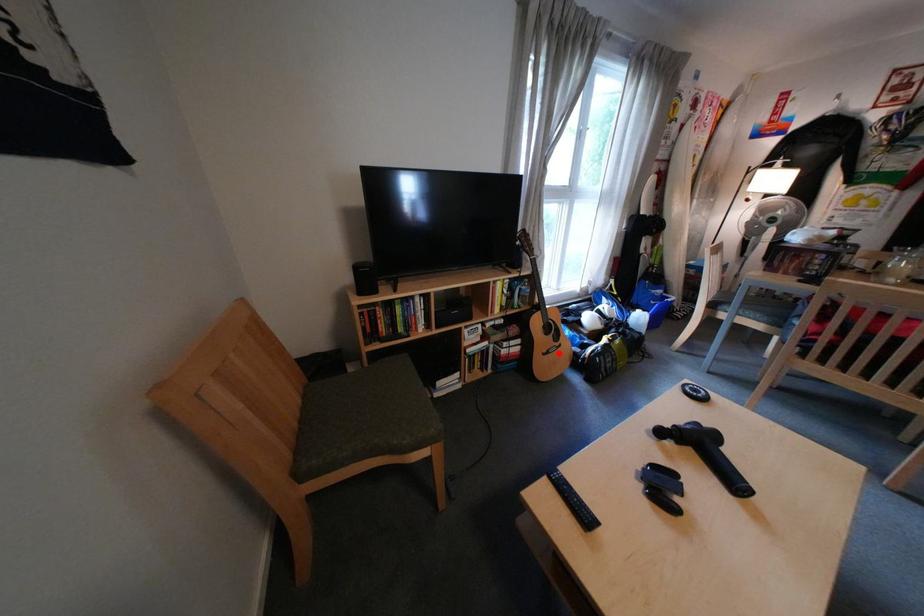
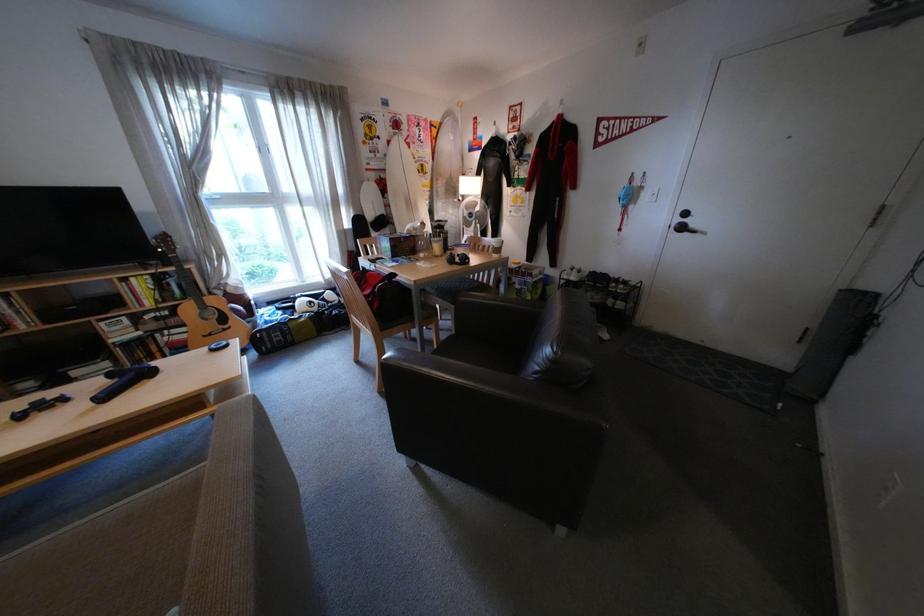
Question: A red point is marked in image1. In image2, is the corresponding 3D point closer to the camera or farther? Reply with the corresponding letter.

Choices:
 (A) The corresponding 3D point is closer.
 (B) The corresponding 3D point is farther.

Answer: (A)